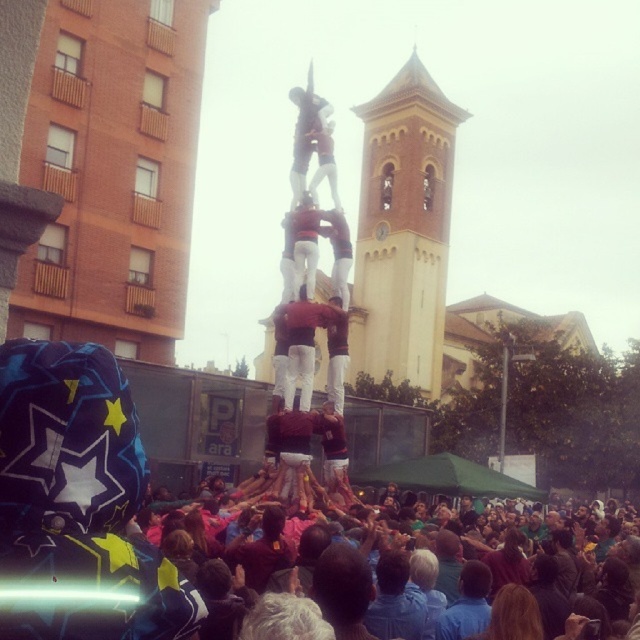
Question: Can you confirm if dark blue fabric crowd at lower center is bigger than yellow brick tower at upper center?

Choices:
 (A) no
 (B) yes

Answer: (B)

Question: Which point appears farthest from the camera in this image?

Choices:
 (A) (406, 365)
 (B) (310, 376)
 (C) (353, 579)

Answer: (A)

Question: Does dark blue fabric crowd at lower center appear over yellow brick tower at upper center?

Choices:
 (A) no
 (B) yes

Answer: (A)

Question: Does dark blue fabric crowd at lower center appear on the right side of matte red shirt at center?

Choices:
 (A) no
 (B) yes

Answer: (B)

Question: Estimate the real-world distances between objects in this image. Which object is farther from the yellow brick tower at upper center?

Choices:
 (A) dark blue fabric crowd at lower center
 (B) matte red shirt at center

Answer: (B)

Question: Which object appears farthest from the camera in this image?

Choices:
 (A) yellow brick tower at upper center
 (B) matte red shirt at center
 (C) dark blue fabric crowd at lower center

Answer: (A)